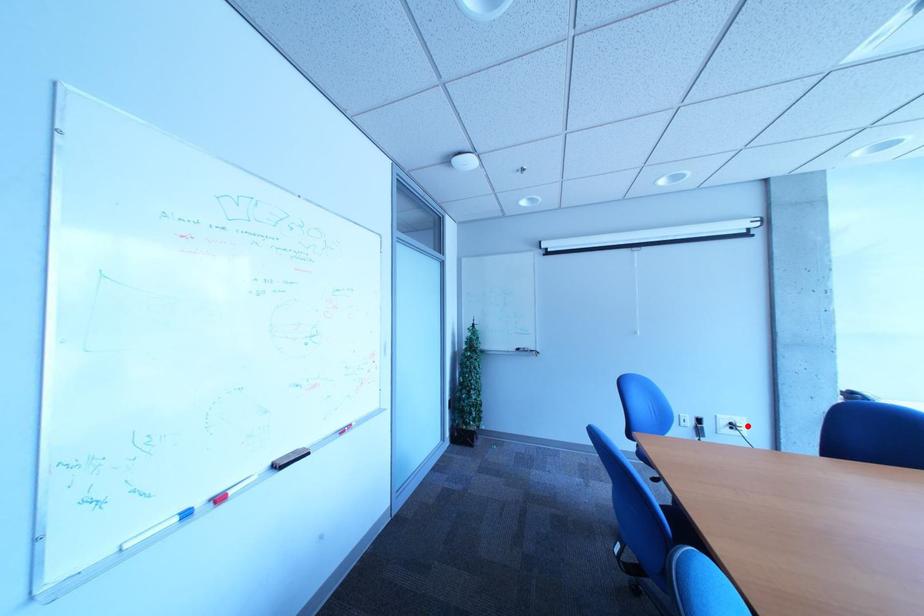
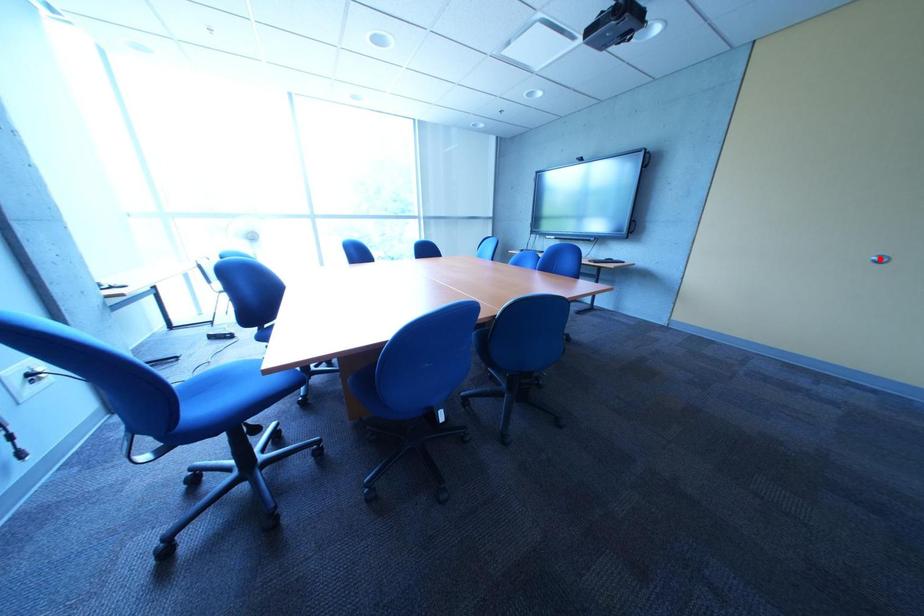
I am providing you with two images of the same scene from different viewpoints. A red point is marked on the first image and another point is marked on the second image. Do the highlighted points in image1 and image2 indicate the same real-world spot?

No